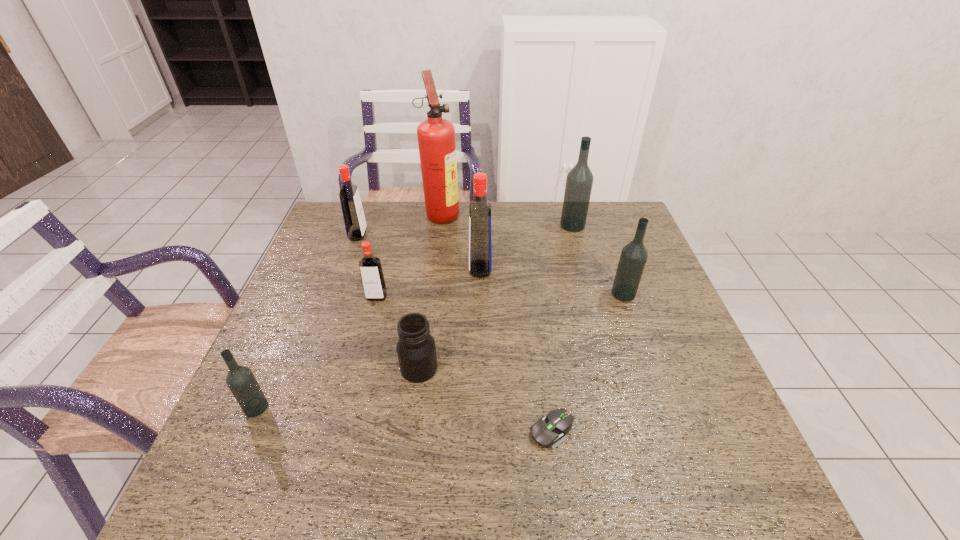
Image resolution: width=960 pixels, height=540 pixels. I want to click on object at the right edge, so click(634, 255).

You are a GUI agent. You are given a task and a screenshot of the screen. Output one action in this format:
    pyautogui.click(x=<x>, y=<y>)
    Task: Click on the object at the far left corner
    
    Given the screenshot: What is the action you would take?
    pyautogui.click(x=355, y=224)

Find the location of a particular element. vacant space at the far edge of the desktop is located at coordinates (468, 233).

In order to click on free space at the near edge in this screenshot , I will do `click(338, 478)`.

Where is `free space at the left edge of the desktop`? Image resolution: width=960 pixels, height=540 pixels. free space at the left edge of the desktop is located at coordinates (273, 330).

I want to click on free spot at the right edge of the desktop, so click(732, 453).

You are a GUI agent. You are given a task and a screenshot of the screen. Output one action in this format:
    pyautogui.click(x=<x>, y=<y>)
    Task: Click on the vacant space at the far right corner of the desktop
    Image resolution: width=960 pixels, height=540 pixels.
    Given the screenshot: What is the action you would take?
    pyautogui.click(x=616, y=213)

You are a GUI agent. You are given a task and a screenshot of the screen. Output one action in this format:
    pyautogui.click(x=<x>, y=<y>)
    Task: Click on the free spot between the fire extinguisher and the seventh farthest object
    
    Given the screenshot: What is the action you would take?
    pyautogui.click(x=430, y=291)

At what (x,y) coordinates should I click in order to perform the action: click on free space between the jar and the farthest red vodka. Please return your answer as a coordinate pair (x, y). Image resolution: width=960 pixels, height=540 pixels. Looking at the image, I should click on (389, 302).

Identify the location of vacant space that is in between the shortest object and the second object from right to left. The image size is (960, 540). [x=563, y=328].